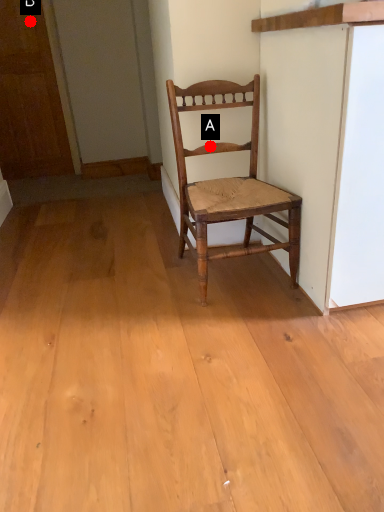
Question: Two points are circled on the image, labeled by A and B beside each circle. Which point is farther from the camera taking this photo?

Choices:
 (A) A is further
 (B) B is further

Answer: (B)